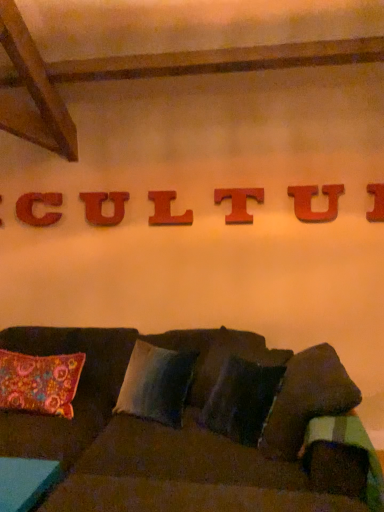
Question: Is wooden letter i at upper center, which ranks as the 7th letter in left-to-right order, closer to the viewer compared to wooden letter u at center, which is the third letter in left-to-right order?

Choices:
 (A) yes
 (B) no

Answer: (A)

Question: Is wooden letter i at upper center, which is the 1th letter in right-to-left order, wider than wooden letter u at center, which is the fifth letter in right-to-left order?

Choices:
 (A) no
 (B) yes

Answer: (B)

Question: From a real-world perspective, is wooden letter i at upper center, which ranks as the 7th letter in left-to-right order, positioned under wooden letter u at center, which is the fifth letter in right-to-left order, based on gravity?

Choices:
 (A) yes
 (B) no

Answer: (B)

Question: Is wooden letter i at upper center, which ranks as the 7th letter in left-to-right order, next to wooden letter u at center, which is the third letter in left-to-right order?

Choices:
 (A) no
 (B) yes

Answer: (A)

Question: Is wooden letter i at upper center, which ranks as the 7th letter in left-to-right order, oriented away from wooden letter u at center, which is the fifth letter in right-to-left order?

Choices:
 (A) no
 (B) yes

Answer: (A)

Question: Can you confirm if wooden letter i at upper center, which is the 1th letter in right-to-left order, is positioned to the left of wooden letter u at center, which is the third letter in left-to-right order?

Choices:
 (A) no
 (B) yes

Answer: (A)

Question: Is wooden letter c at upper center, acting as the 2th letter starting from the left, in contact with wooden letter t at center, which appears as the 3th letter when viewed from the right?

Choices:
 (A) yes
 (B) no

Answer: (B)

Question: From the image's perspective, does wooden letter c at upper center, which ranks as the sixth letter in right-to-left order, appear higher than wooden letter t at center, which appears as the 3th letter when viewed from the right?

Choices:
 (A) no
 (B) yes

Answer: (A)

Question: Is wooden letter c at upper center, acting as the 2th letter starting from the left, thinner than wooden letter t at center, which appears as the 3th letter when viewed from the right?

Choices:
 (A) yes
 (B) no

Answer: (B)

Question: Would you say wooden letter c at upper center, which ranks as the sixth letter in right-to-left order, contains wooden letter t at center, which is the 5th letter in left-to-right order?

Choices:
 (A) yes
 (B) no

Answer: (B)

Question: Does wooden letter c at upper center, acting as the 2th letter starting from the left, have a smaller size compared to wooden letter t at center, which is the 5th letter in left-to-right order?

Choices:
 (A) yes
 (B) no

Answer: (B)

Question: Considering the relative positions of wooden letter c at upper center, acting as the 2th letter starting from the left, and wooden letter t at center, which is the 5th letter in left-to-right order, in the image provided, is wooden letter c at upper center, acting as the 2th letter starting from the left, behind wooden letter t at center, which is the 5th letter in left-to-right order,?

Choices:
 (A) yes
 (B) no

Answer: (A)

Question: From a real-world perspective, is wooden letter i at upper center, which is the 1th letter in right-to-left order, physically below wooden letter c at upper center, acting as the 2th letter starting from the left?

Choices:
 (A) yes
 (B) no

Answer: (B)